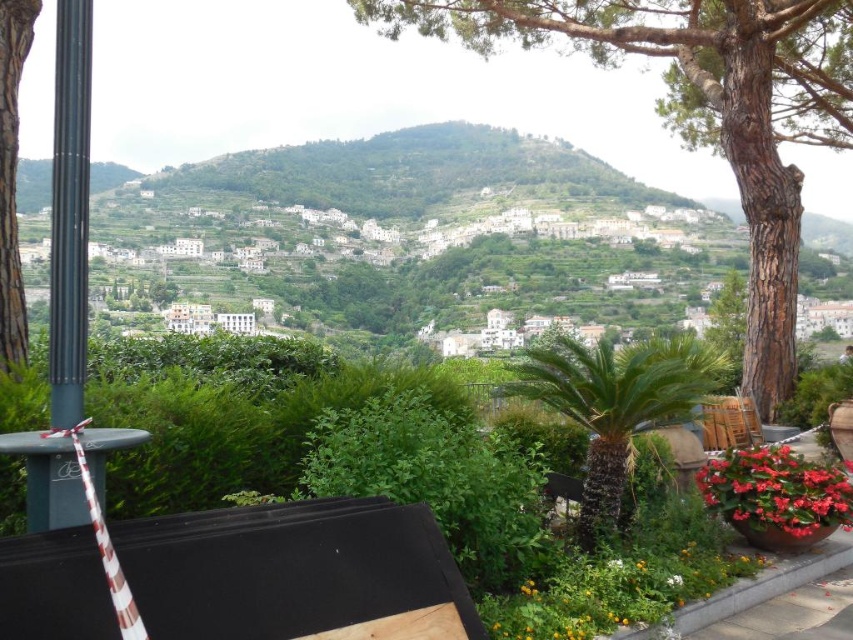
Who is positioned more to the left, green leafy hillside at center or brown rough bark tree at upper center?

green leafy hillside at center is more to the left.

Which of these two, green leafy hillside at center or brown rough bark tree at upper center, stands shorter?

Standing shorter between the two is brown rough bark tree at upper center.

Image resolution: width=853 pixels, height=640 pixels. What do you see at coordinates (410, 230) in the screenshot? I see `green leafy hillside at center` at bounding box center [410, 230].

Image resolution: width=853 pixels, height=640 pixels. I want to click on green leafy hillside at center, so click(410, 230).

Does green leafy palm at center appear under vivid red petals at lower right?

No, green leafy palm at center is not below vivid red petals at lower right.

Is green leafy palm at center smaller than vivid red petals at lower right?

No, green leafy palm at center is not smaller than vivid red petals at lower right.

Who is more distant from viewer, (685, 392) or (706, 484)?

The point (685, 392) is behind.

This screenshot has width=853, height=640. What are the coordinates of `green leafy palm at center` in the screenshot? It's located at (614, 404).

What do you see at coordinates (614, 404) in the screenshot?
I see `green leafy palm at center` at bounding box center [614, 404].

The height and width of the screenshot is (640, 853). I want to click on green leafy palm at center, so click(614, 404).